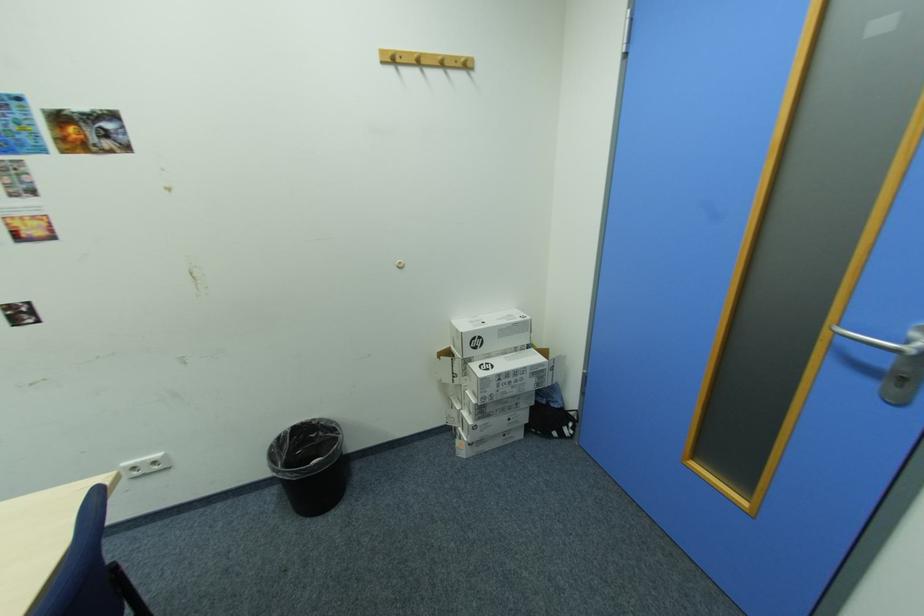
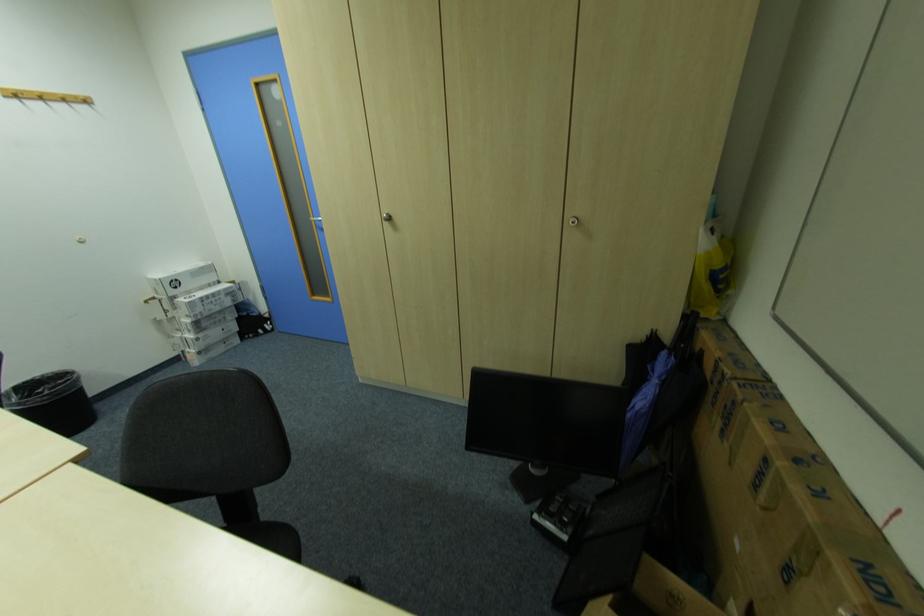
Locate, in the second image, the point that corresponds to point 322,436 in the first image.

(49, 391)